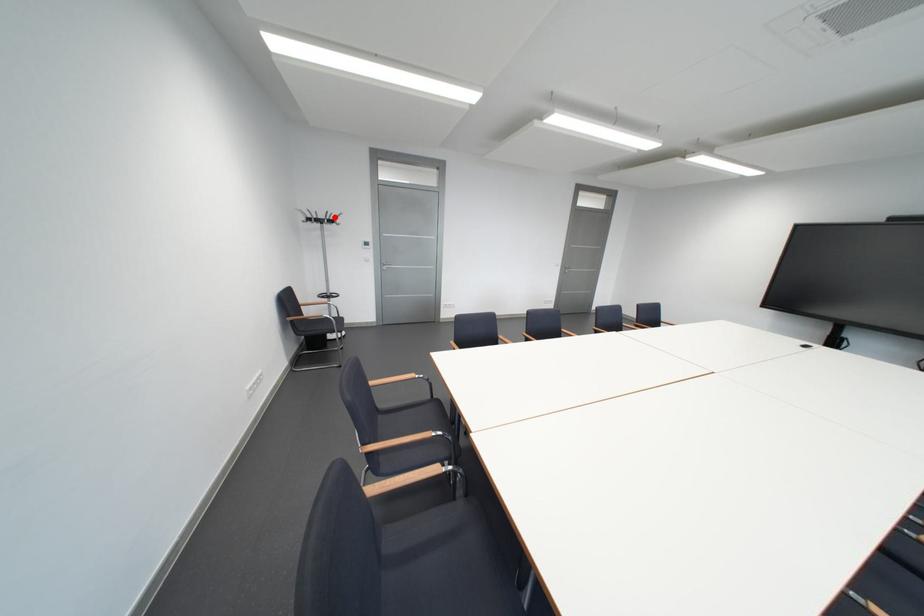
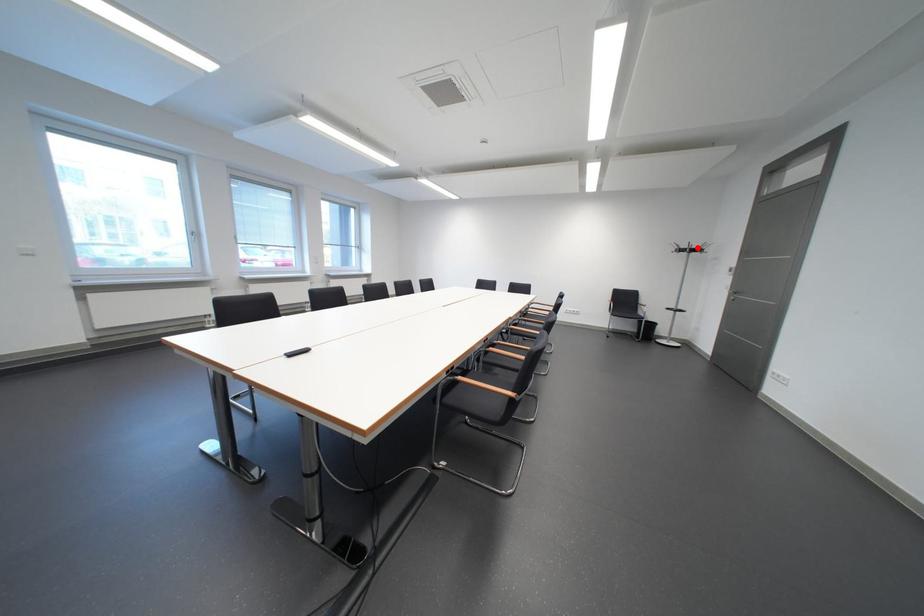
I am providing you with two images of the same scene from different viewpoints. A red point is marked on the first image and another point is marked on the second image. Is the red point in image1 aligned with the point shown in image2?

Yes